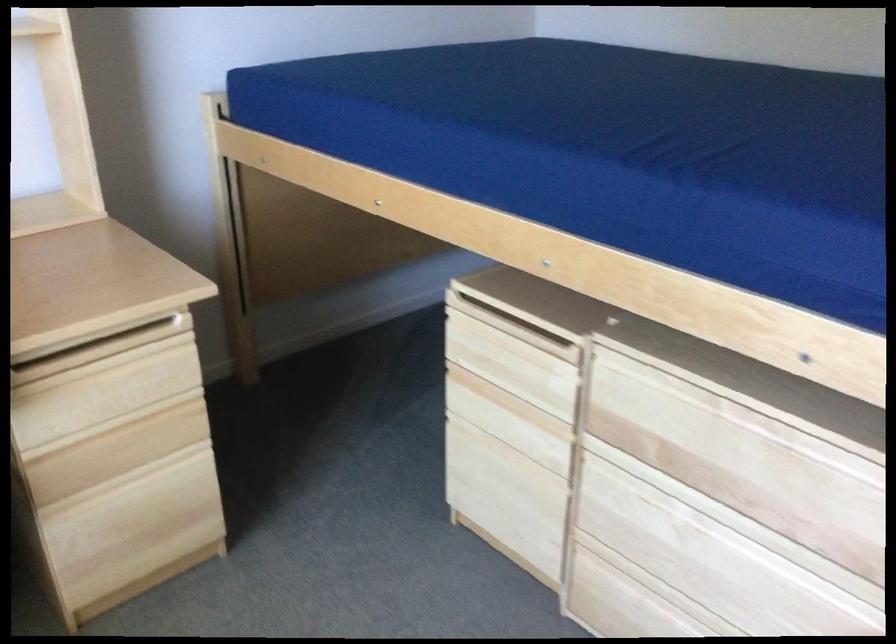
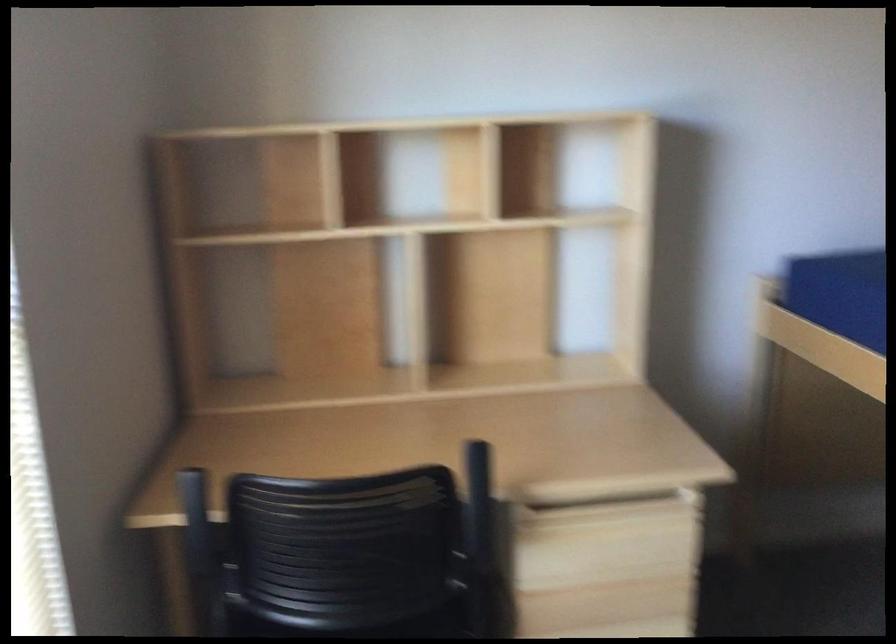
In the second image, find the point that corresponds to point 112,354 in the first image.

(616, 520)